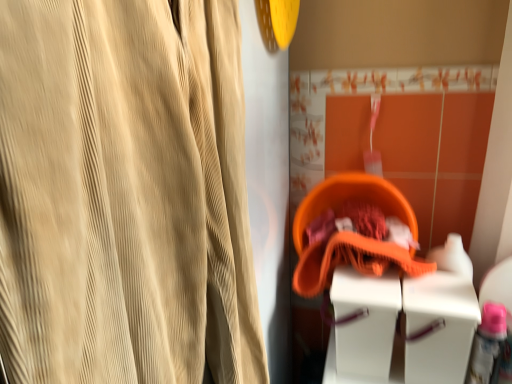
Question: Can you confirm if orange fabric basket at center is bigger than white plastic vanity at lower right?

Choices:
 (A) yes
 (B) no

Answer: (A)

Question: Is orange fabric basket at center looking in the opposite direction of white plastic vanity at lower right?

Choices:
 (A) yes
 (B) no

Answer: (B)

Question: Is orange fabric basket at center positioned before white plastic vanity at lower right?

Choices:
 (A) yes
 (B) no

Answer: (B)

Question: Does orange fabric basket at center have a greater width compared to white plastic vanity at lower right?

Choices:
 (A) no
 (B) yes

Answer: (A)

Question: From the image's perspective, is orange fabric basket at center above white plastic vanity at lower right?

Choices:
 (A) yes
 (B) no

Answer: (A)

Question: Is orange fabric basket at center positioned behind white plastic vanity at lower right?

Choices:
 (A) yes
 (B) no

Answer: (A)

Question: Is orange fabric basket at center far away from beige corduroy curtain at left?

Choices:
 (A) yes
 (B) no

Answer: (B)

Question: Can you confirm if orange fabric basket at center is bigger than beige corduroy curtain at left?

Choices:
 (A) yes
 (B) no

Answer: (B)

Question: From the image's perspective, does orange fabric basket at center appear lower than beige corduroy curtain at left?

Choices:
 (A) yes
 (B) no

Answer: (B)

Question: Is the depth of orange fabric basket at center less than that of beige corduroy curtain at left?

Choices:
 (A) no
 (B) yes

Answer: (A)

Question: Is orange fabric basket at center facing towards beige corduroy curtain at left?

Choices:
 (A) yes
 (B) no

Answer: (A)

Question: Can you confirm if orange fabric basket at center is smaller than beige corduroy curtain at left?

Choices:
 (A) no
 (B) yes

Answer: (B)

Question: Is beige corduroy curtain at left smaller than orange fabric basket at center?

Choices:
 (A) yes
 (B) no

Answer: (B)